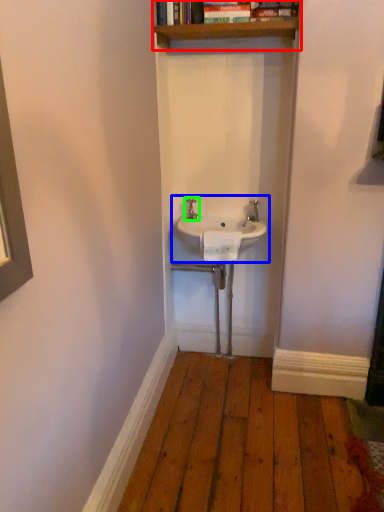
Question: Considering the real-world distances, which object is farthest from shelf (highlighted by a red box)? sink (highlighted by a blue box) or tap (highlighted by a green box)?

Choices:
 (A) sink
 (B) tap

Answer: (A)